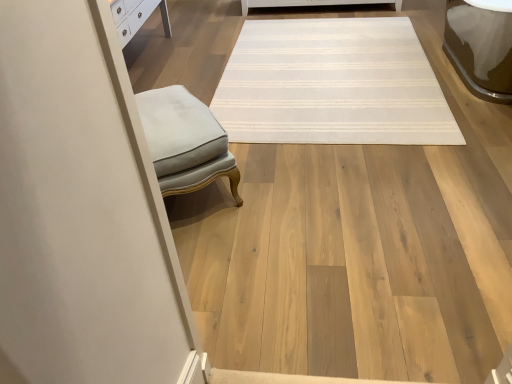
Question: Based on their sizes in the image, would you say light gray fabric ottoman at left is bigger or smaller than white striped rug at center?

Choices:
 (A) small
 (B) big

Answer: (A)

Question: In the image, is light gray fabric ottoman at left positioned in front of or behind white striped rug at center?

Choices:
 (A) front
 (B) behind

Answer: (A)

Question: Considering the positions of light gray fabric ottoman at left and white striped rug at center in the image, is light gray fabric ottoman at left taller or shorter than white striped rug at center?

Choices:
 (A) tall
 (B) short

Answer: (A)

Question: In the image, is white striped rug at center positioned in front of or behind light gray fabric ottoman at left?

Choices:
 (A) behind
 (B) front

Answer: (A)

Question: From their relative heights in the image, would you say white striped rug at center is taller or shorter than light gray fabric ottoman at left?

Choices:
 (A) short
 (B) tall

Answer: (A)

Question: Is white striped rug at center wider or thinner than light gray fabric ottoman at left?

Choices:
 (A) thin
 (B) wide

Answer: (B)

Question: Based on their positions, is white striped rug at center located to the left or right of light gray fabric ottoman at left?

Choices:
 (A) left
 (B) right

Answer: (B)